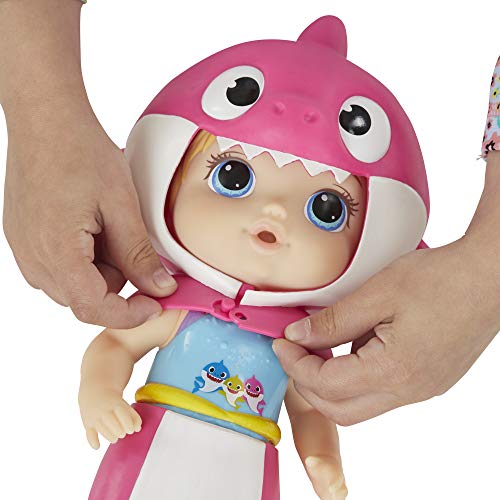
The width and height of the screenshot is (500, 500). I want to click on child's toy, so click(360, 144).